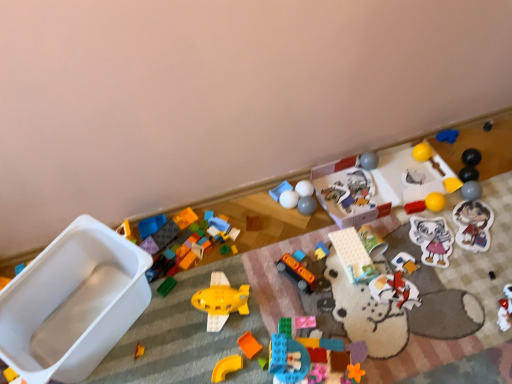
Image resolution: width=512 pixels, height=384 pixels. What are the coordinates of `free space to the left of white matte balls at center, the ninth toy viewed from the left` in the screenshot? It's located at coord(251,212).